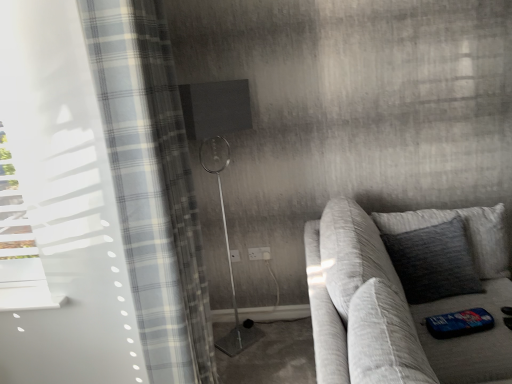
Question: Does textured gray pillow at right have a larger size compared to matte black shower at center?

Choices:
 (A) yes
 (B) no

Answer: (B)

Question: Is textured gray pillow at right beside matte black shower at center?

Choices:
 (A) yes
 (B) no

Answer: (B)

Question: Can you confirm if textured gray pillow at right is smaller than matte black shower at center?

Choices:
 (A) yes
 (B) no

Answer: (A)

Question: Is textured gray pillow at right turned away from matte black shower at center?

Choices:
 (A) no
 (B) yes

Answer: (A)

Question: Is textured gray pillow at right wider than matte black shower at center?

Choices:
 (A) yes
 (B) no

Answer: (B)

Question: Considering the relative positions of textured gray pillow at right and matte black shower at center in the image provided, is textured gray pillow at right to the left of matte black shower at center from the viewer's perspective?

Choices:
 (A) no
 (B) yes

Answer: (A)

Question: Considering the relative sizes of textured gray couch at right and matte black shower at center in the image provided, is textured gray couch at right bigger than matte black shower at center?

Choices:
 (A) yes
 (B) no

Answer: (A)

Question: Can you confirm if textured gray couch at right is wider than matte black shower at center?

Choices:
 (A) yes
 (B) no

Answer: (A)

Question: Is textured gray couch at right turned away from matte black shower at center?

Choices:
 (A) no
 (B) yes

Answer: (B)

Question: Is textured gray couch at right located outside matte black shower at center?

Choices:
 (A) no
 (B) yes

Answer: (B)

Question: From the image's perspective, is textured gray couch at right under matte black shower at center?

Choices:
 (A) yes
 (B) no

Answer: (A)

Question: Can you confirm if textured gray couch at right is shorter than matte black shower at center?

Choices:
 (A) yes
 (B) no

Answer: (A)

Question: Is white plastic electric outlet at center, which ranks as the first electric outlet in right-to-left order, at the left side of white plastic electric outlet at center, which is counted as the second electric outlet, starting from the right?

Choices:
 (A) no
 (B) yes

Answer: (A)